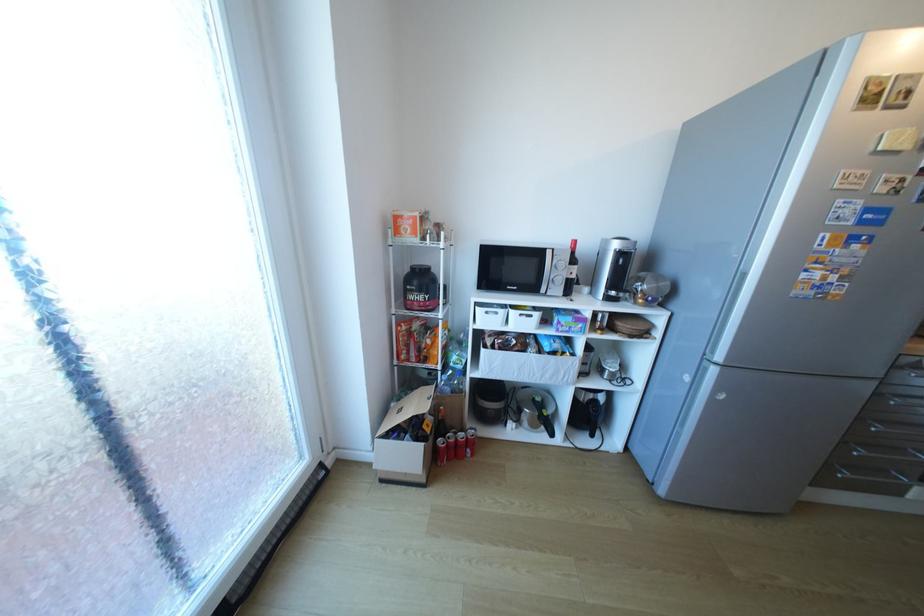
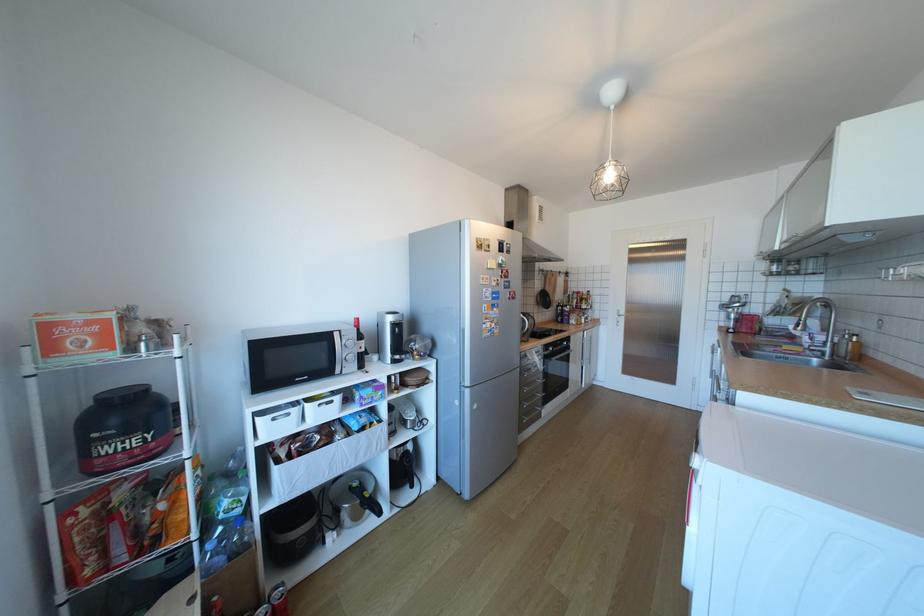
The point at (837, 466) is marked in the first image. Where is the corresponding point in the second image?

(529, 419)